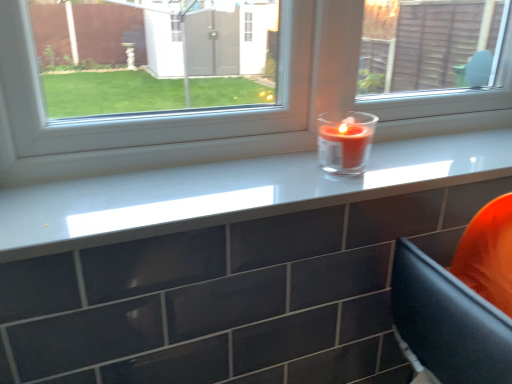
Question: Could you tell me if translucent glass candle at center is facing transparent glass candle at center?

Choices:
 (A) no
 (B) yes

Answer: (A)

Question: From the image's perspective, would you say translucent glass candle at center is positioned over transparent glass candle at center?

Choices:
 (A) yes
 (B) no

Answer: (B)

Question: Would you say translucent glass candle at center contains transparent glass candle at center?

Choices:
 (A) yes
 (B) no

Answer: (B)

Question: Does translucent glass candle at center have a lesser height compared to transparent glass candle at center?

Choices:
 (A) no
 (B) yes

Answer: (B)

Question: Is translucent glass candle at center oriented away from transparent glass candle at center?

Choices:
 (A) yes
 (B) no

Answer: (A)

Question: From a real-world perspective, is translucent glass candle at center on transparent glass candle at center?

Choices:
 (A) yes
 (B) no

Answer: (B)

Question: Is translucent glass candle at center turned away from matte glass candle at upper center?

Choices:
 (A) yes
 (B) no

Answer: (B)

Question: Could you tell me if translucent glass candle at center is turned towards matte glass candle at upper center?

Choices:
 (A) yes
 (B) no

Answer: (B)

Question: Is translucent glass candle at center to the right of matte glass candle at upper center from the viewer's perspective?

Choices:
 (A) no
 (B) yes

Answer: (B)

Question: Is translucent glass candle at center shorter than matte glass candle at upper center?

Choices:
 (A) no
 (B) yes

Answer: (A)

Question: Is translucent glass candle at center thinner than matte glass candle at upper center?

Choices:
 (A) no
 (B) yes

Answer: (B)

Question: Is translucent glass candle at center bigger than matte glass candle at upper center?

Choices:
 (A) yes
 (B) no

Answer: (B)

Question: Is transparent glass candle at center thinner than matte glass candle at upper center?

Choices:
 (A) yes
 (B) no

Answer: (A)